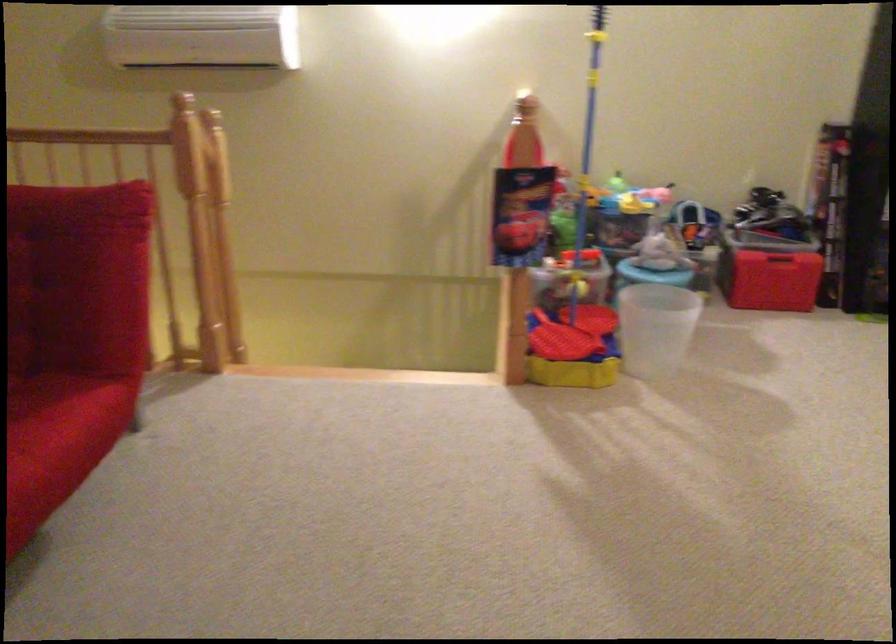
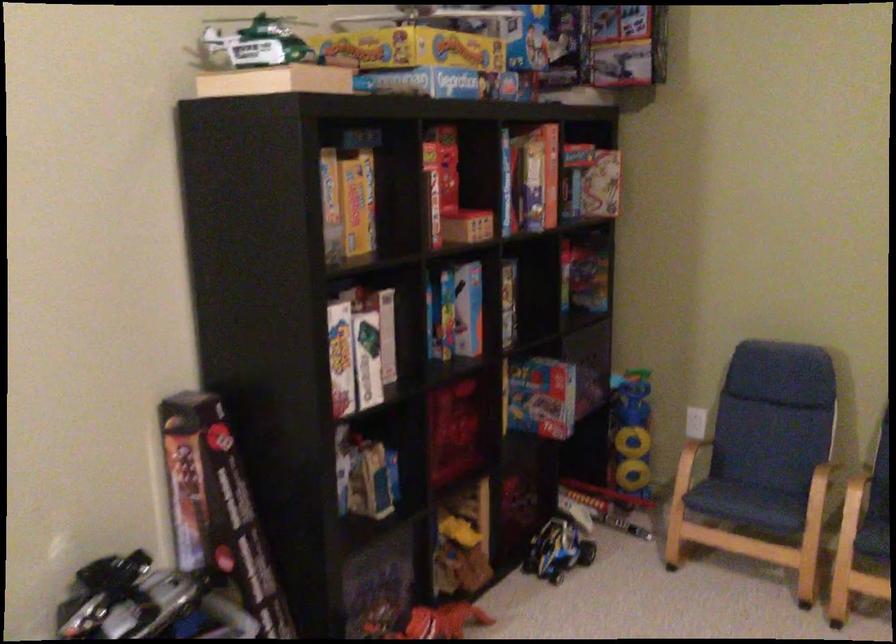
Find the pixel in the second image that matches [824,158] in the first image.

(186, 471)